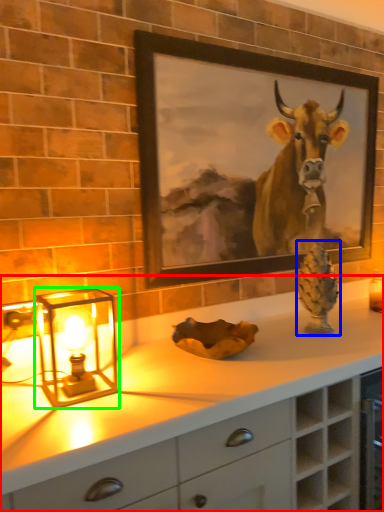
Question: Considering the real-world distances, which object is closest to countertop (highlighted by a red box)? pine cone (highlighted by a blue box) or table lamp (highlighted by a green box).

Choices:
 (A) pine cone
 (B) table lamp

Answer: (B)